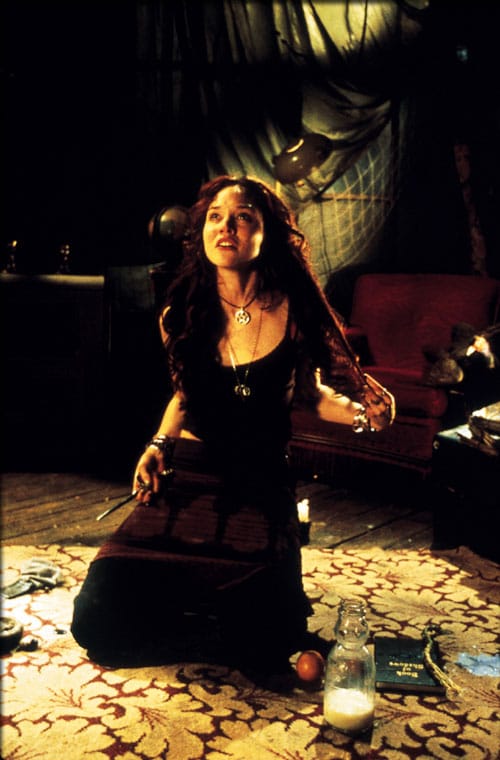
Where is `chair`? The height and width of the screenshot is (760, 500). chair is located at coordinates (399, 346).